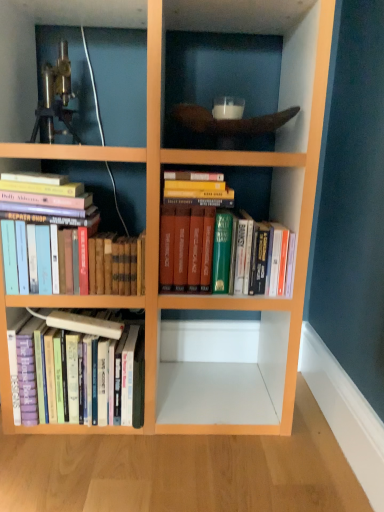
Question: Is hardcover books at left, which is counted as the second book, starting from the left, to the left or to the right of hardcover books at center, which is the 1th book in right-to-left order, in the image?

Choices:
 (A) right
 (B) left

Answer: (B)

Question: Is hardcover books at left, the 2th book positioned from the right, inside the boundaries of hardcover books at center, which is the 1th book in right-to-left order, or outside?

Choices:
 (A) outside
 (B) inside

Answer: (A)

Question: Which is farther from the hardcover books at lower left, which ranks as the third book in right-to-left order?

Choices:
 (A) metallic tripod at upper left
 (B) hardcover books at center, which is the 3th book from left to right
 (C) hardcover books at left, the 2th book positioned from the right

Answer: (A)

Question: Which is nearer to the hardcover books at left, the 2th book positioned from the right?

Choices:
 (A) hardcover books at center, which is the 1th book in right-to-left order
 (B) metallic tripod at upper left
 (C) hardcover books at lower left, which appears as the first book when viewed from the left

Answer: (C)